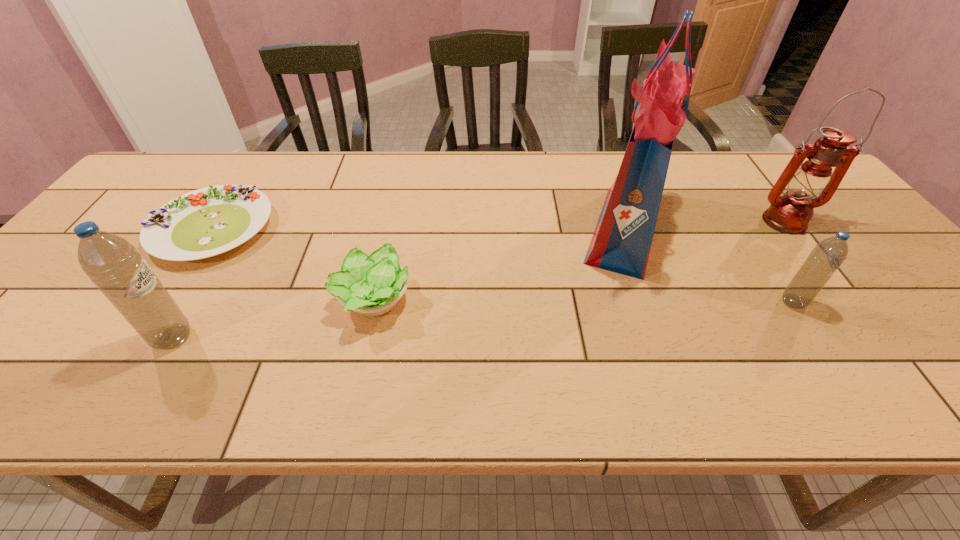
Please mark a free spot for a new water_bottle to balance the arrangement. Please provide its 2D coordinates. Your answer should be formatted as a tuple, i.e. [(x, y)], where the tuple contains the x and y coordinates of a point satisfying the conditions above.

[(494, 319)]